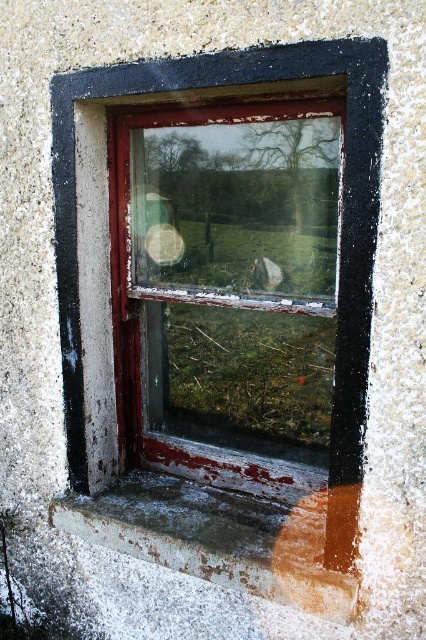
Question: Which object is closer to the camera taking this photo?

Choices:
 (A) brown wood at lower right
 (B) rusty concrete window sill at lower center

Answer: (A)

Question: Which point is farther to the camera?

Choices:
 (A) rusty concrete window sill at lower center
 (B) rusty glass window at center

Answer: (A)

Question: Which object appears farthest from the camera in this image?

Choices:
 (A) brown wood at lower right
 (B) rusty glass window at center
 (C) rusty concrete window sill at lower center

Answer: (C)

Question: Does rusty glass window at center have a larger size compared to rusty concrete window sill at lower center?

Choices:
 (A) yes
 (B) no

Answer: (A)

Question: Does rusty concrete window sill at lower center come behind brown wood at lower right?

Choices:
 (A) yes
 (B) no

Answer: (A)

Question: Is rusty glass window at center smaller than brown wood at lower right?

Choices:
 (A) yes
 (B) no

Answer: (B)